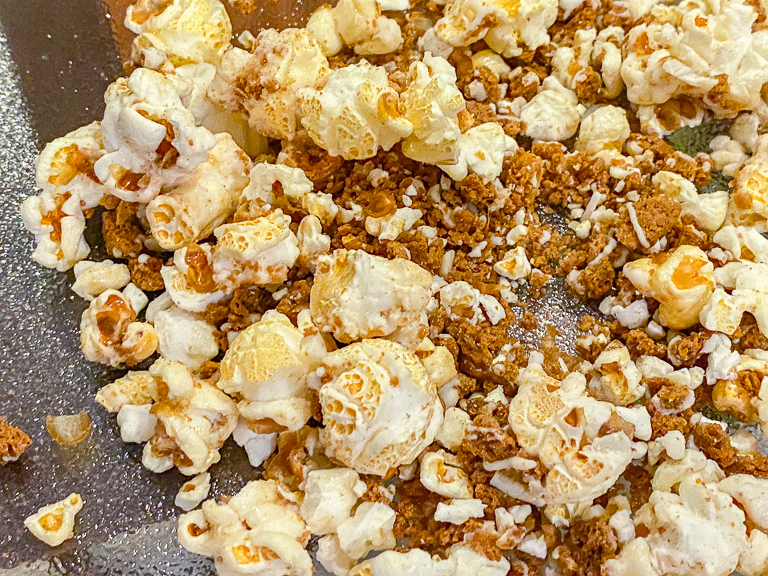
Image resolution: width=768 pixels, height=576 pixels. Identify the location of textured glass surface with green hue. (690, 138).